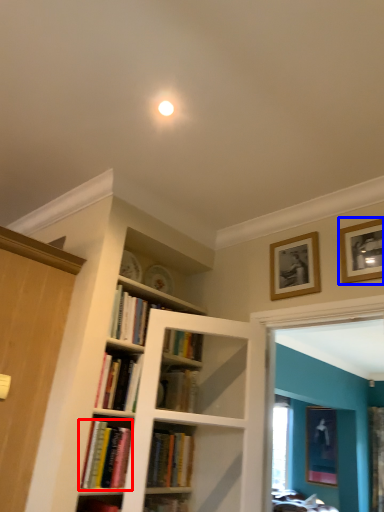
Question: Which point is closer to the camera, book (highlighted by a red box) or picture frame (highlighted by a blue box)?

Choices:
 (A) book
 (B) picture frame

Answer: (A)